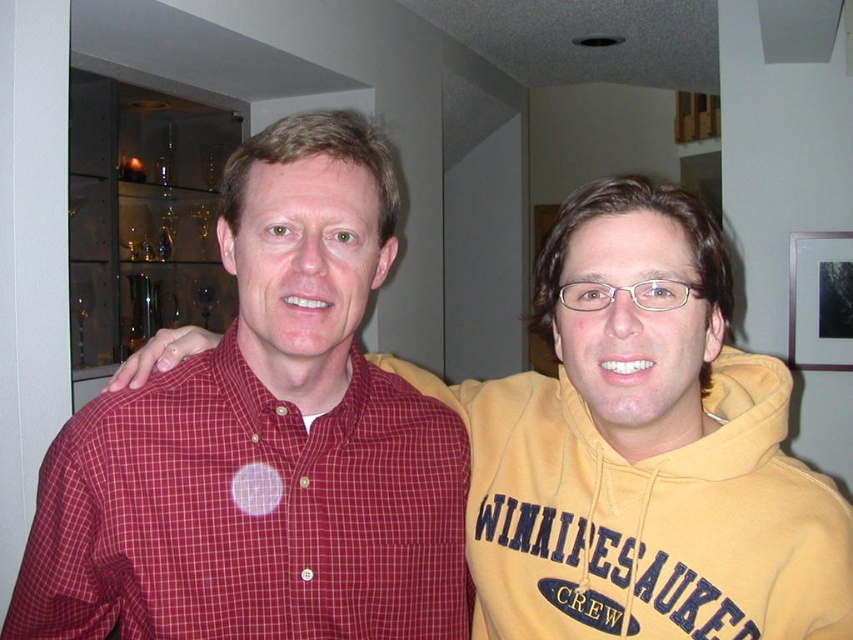
Question: Which point is closer to the camera?

Choices:
 (A) checkered cotton shirt at center
 (B) matte red shirt at left

Answer: (B)

Question: Does matte red shirt at left lie behind checkered cotton shirt at center?

Choices:
 (A) no
 (B) yes

Answer: (A)

Question: Among these points, which one is farthest from the camera?

Choices:
 (A) (578, 298)
 (B) (396, 424)

Answer: (B)

Question: Does matte red shirt at left come behind checkered cotton shirt at center?

Choices:
 (A) yes
 (B) no

Answer: (B)

Question: Which of the following is the closest to the observer?

Choices:
 (A) checkered cotton shirt at center
 (B) matte red shirt at left

Answer: (B)

Question: From the image, what is the correct spatial relationship of matte red shirt at left in relation to checkered cotton shirt at center?

Choices:
 (A) below
 (B) above

Answer: (B)